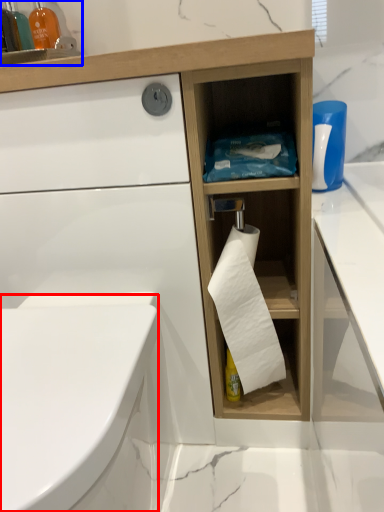
Question: Among these objects, which one is farthest to the camera, bidet (highlighted by a red box) or cabinet (highlighted by a blue box)?

Choices:
 (A) bidet
 (B) cabinet

Answer: (B)